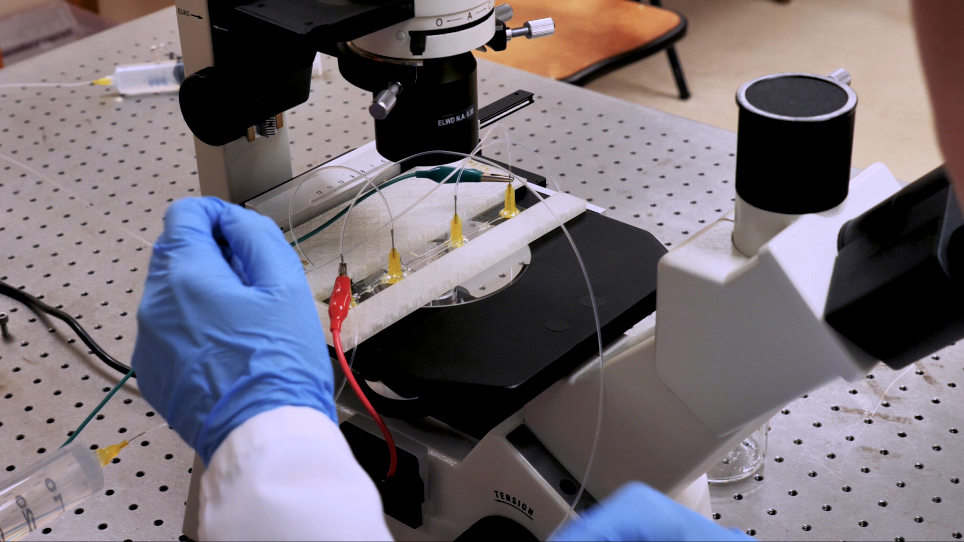
Find the location of a particular element. The width and height of the screenshot is (964, 542). table leg is located at coordinates (678, 72).